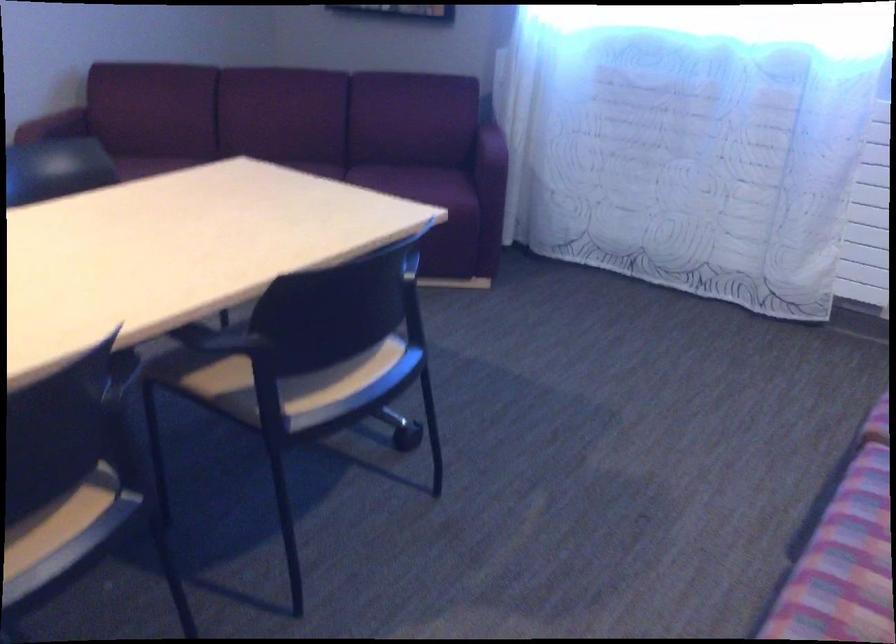
This screenshot has width=896, height=644. What are the coordinates of `chair sitting surface` in the screenshot? It's located at (328, 382).